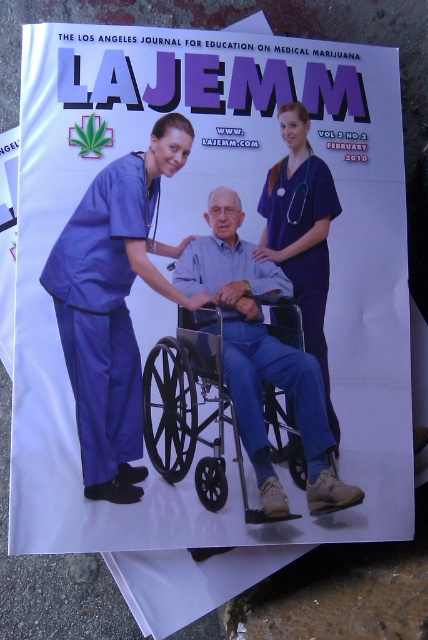
You are a graphic designer reviewing the magazine cover for LAJEMM. You notice the metallic silver wheelchair at center and the matte blue scrubs at center. Which object is positioned lower on the cover?

The metallic silver wheelchair at center is positioned lower than the matte blue scrubs at center.

You are a graphic designer reviewing the magazine cover for LAJEMM. You notice two sets of matte blue scrubs at left and matte blue scrubs at center. Which set of scrubs appears bigger in size?

The matte blue scrubs at left appears bigger in size compared to the matte blue scrubs at center.

You are a photographer standing 10 feet away from the metallic silver wheelchair at center. You want to take a closeup photo of it without moving the wheelchair. Is the wheelchair within your camera lens range if your camera can focus as close as 24 inches?

The metallic silver wheelchair at center is 25.97 inches away from the camera. Since your camera can focus as close as 24 inches, the wheelchair is slightly out of the camera lens range because it is 25.97 inches away, which is beyond the minimum focus distance of 24 inches.